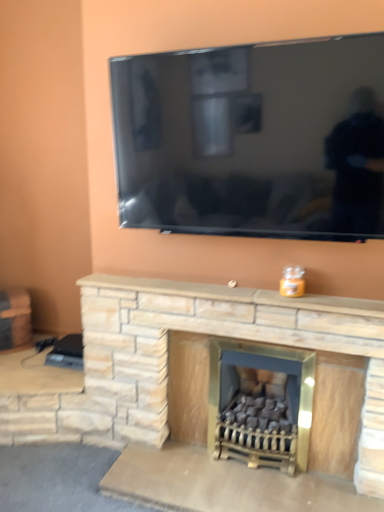
This screenshot has width=384, height=512. I want to click on vacant space in natural stone fireplace at center (from a real-world perspective), so click(x=215, y=301).